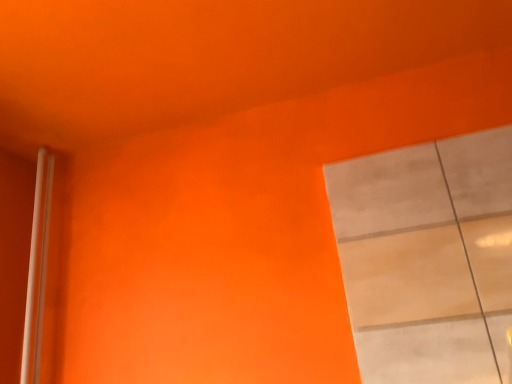
This screenshot has height=384, width=512. Describe the element at coordinates (37, 269) in the screenshot. I see `white glossy pole at left` at that location.

Find the location of a particular element. white glossy pole at left is located at coordinates (37, 269).

Identify the location of white glossy pole at left. (37, 269).